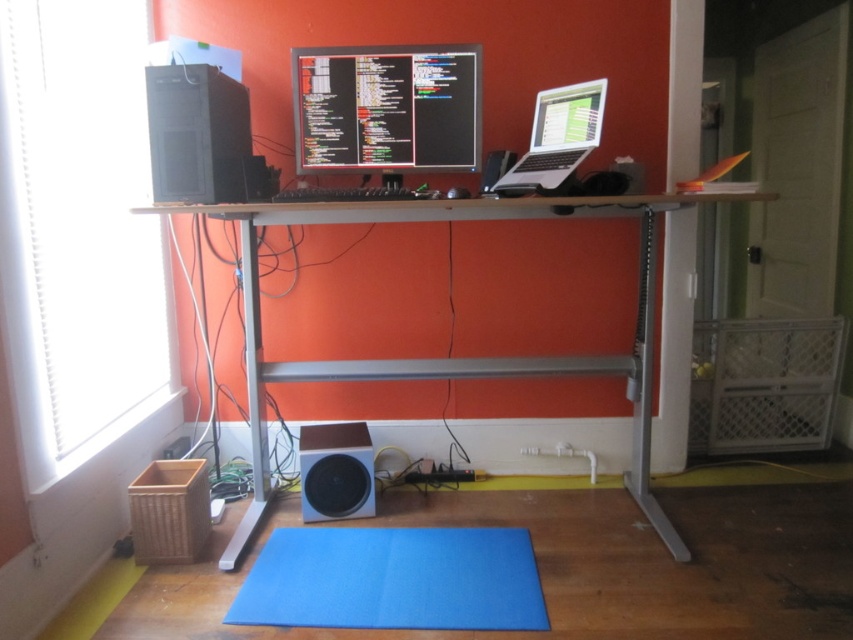
Question: Estimate the real-world distances between objects in this image. Which object is farther from the blue felt mat at lower center?

Choices:
 (A) black glossy monitor at center
 (B) white matte speaker at lower center
 (C) silver metallic laptop at upper right
 (D) wooden desk at center

Answer: (A)

Question: Does blue felt mat at lower center appear on the left side of silver metallic laptop at upper right?

Choices:
 (A) no
 (B) yes

Answer: (B)

Question: Which point appears farthest from the camera in this image?

Choices:
 (A) (560, 92)
 (B) (334, 595)
 (C) (338, 492)

Answer: (C)

Question: Does wooden desk at center come behind silver metallic laptop at upper right?

Choices:
 (A) yes
 (B) no

Answer: (B)

Question: Among these points, which one is nearest to the camera?

Choices:
 (A) (543, 189)
 (B) (643, 380)
 (C) (306, 163)
 (D) (358, 458)

Answer: (A)

Question: Observing the image, what is the correct spatial positioning of black glossy monitor at center in reference to white matte speaker at lower center?

Choices:
 (A) below
 (B) above

Answer: (B)